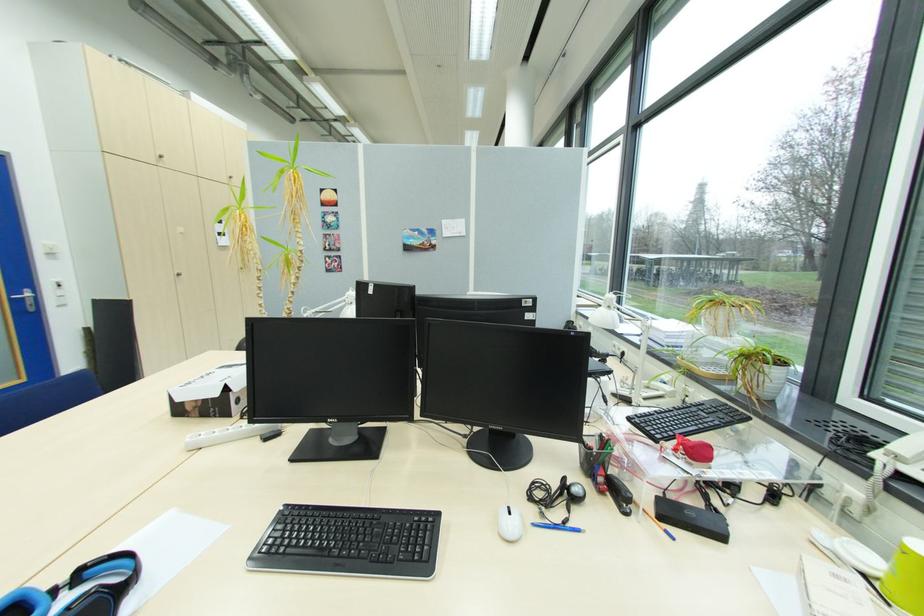
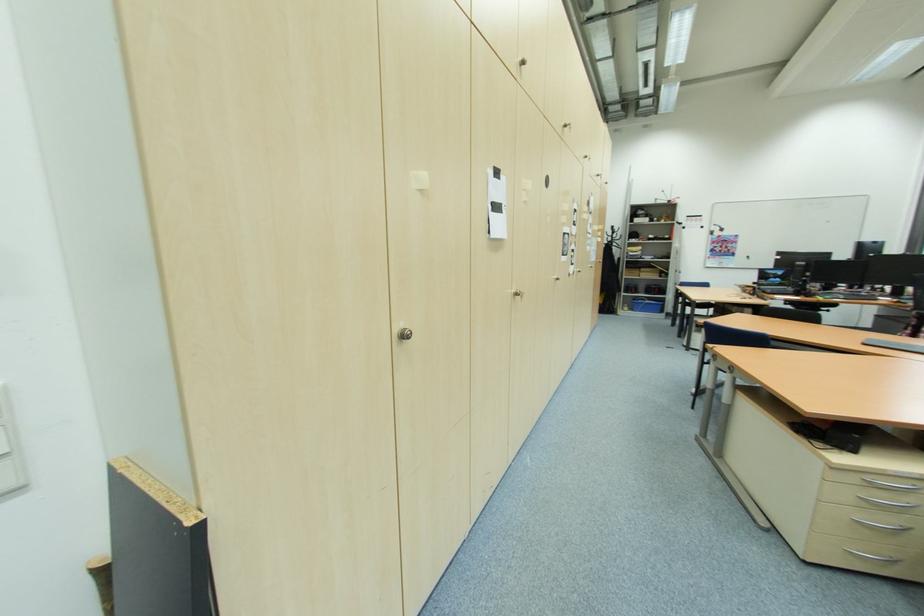
What movement of the cameraman would produce the second image?

The cameraman moved toward left, forward.